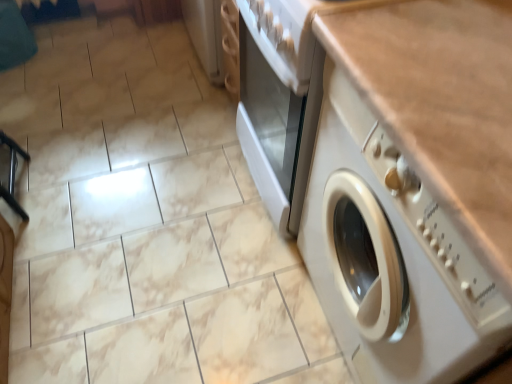
Question: Is white glossy gas stove at upper center bigger than white plastic washing machine at center?

Choices:
 (A) no
 (B) yes

Answer: (A)

Question: Does white glossy gas stove at upper center have a lesser height compared to white plastic washing machine at center?

Choices:
 (A) no
 (B) yes

Answer: (B)

Question: Is white plastic washing machine at center a part of white glossy gas stove at upper center?

Choices:
 (A) yes
 (B) no

Answer: (B)

Question: Does white glossy gas stove at upper center appear on the right side of white plastic washing machine at center?

Choices:
 (A) yes
 (B) no

Answer: (B)

Question: Is white glossy gas stove at upper center at the left side of white plastic washing machine at center?

Choices:
 (A) no
 (B) yes

Answer: (B)

Question: Is white glossy gas stove at upper center smaller than white plastic washing machine at center?

Choices:
 (A) yes
 (B) no

Answer: (A)

Question: Considering the relative sizes of white plastic washing machine at center and white glossy gas stove at upper center in the image provided, is white plastic washing machine at center thinner than white glossy gas stove at upper center?

Choices:
 (A) no
 (B) yes

Answer: (A)

Question: Is white plastic washing machine at center wider than white glossy gas stove at upper center?

Choices:
 (A) yes
 (B) no

Answer: (A)

Question: Considering the relative sizes of white plastic washing machine at center and white glossy gas stove at upper center in the image provided, is white plastic washing machine at center bigger than white glossy gas stove at upper center?

Choices:
 (A) yes
 (B) no

Answer: (A)

Question: From a real-world perspective, is white plastic washing machine at center located beneath white glossy gas stove at upper center?

Choices:
 (A) yes
 (B) no

Answer: (A)

Question: From a real-world perspective, does white plastic washing machine at center stand above white glossy gas stove at upper center?

Choices:
 (A) no
 (B) yes

Answer: (A)

Question: Considering the relative positions of white plastic washing machine at center and white glossy gas stove at upper center in the image provided, is white plastic washing machine at center behind white glossy gas stove at upper center?

Choices:
 (A) no
 (B) yes

Answer: (A)

Question: Is white plastic washing machine at center situated inside white glossy gas stove at upper center or outside?

Choices:
 (A) inside
 (B) outside

Answer: (B)